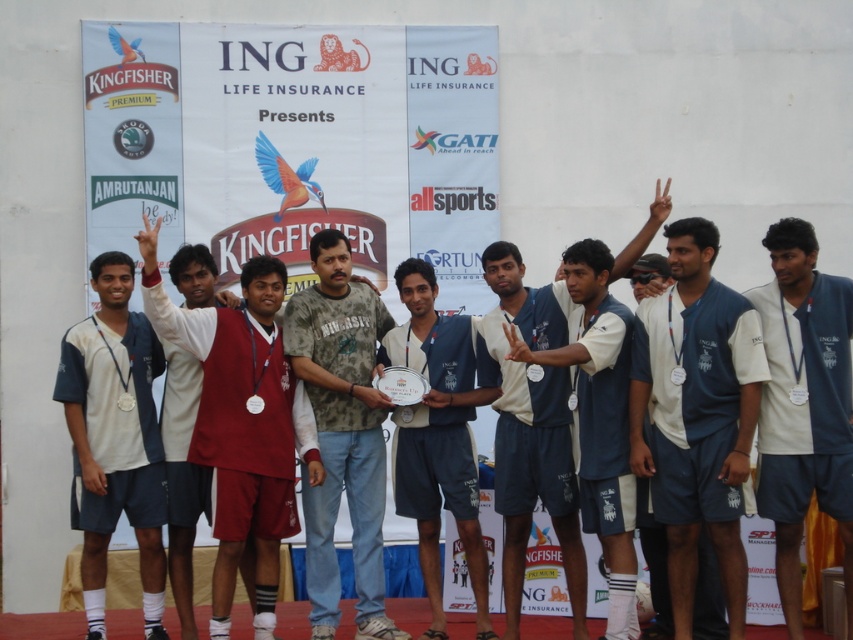
Question: Which point is closer to the camera?

Choices:
 (A) white matte jersey at center
 (B) white matte shirt at center
 (C) blue jersey at center

Answer: (B)

Question: Can you confirm if white matte shirt at center is smaller than white matte jersey at center?

Choices:
 (A) no
 (B) yes

Answer: (B)

Question: Can you confirm if white fabric shirt at center is bigger than white matte jersey at center?

Choices:
 (A) yes
 (B) no

Answer: (B)

Question: Observing the image, what is the correct spatial positioning of white fabric shirt at center in reference to white matte jersey at center?

Choices:
 (A) left
 (B) right

Answer: (B)

Question: Which object is closer to the camera taking this photo?

Choices:
 (A) blue jersey at center
 (B) camouflage fabric shirt at center
 (C) white matte shirt at center
 (D) blue fabric shirt at center

Answer: (C)

Question: Which of the following is the farthest from the observer?

Choices:
 (A) 68,372
 (B) 583,428

Answer: (A)